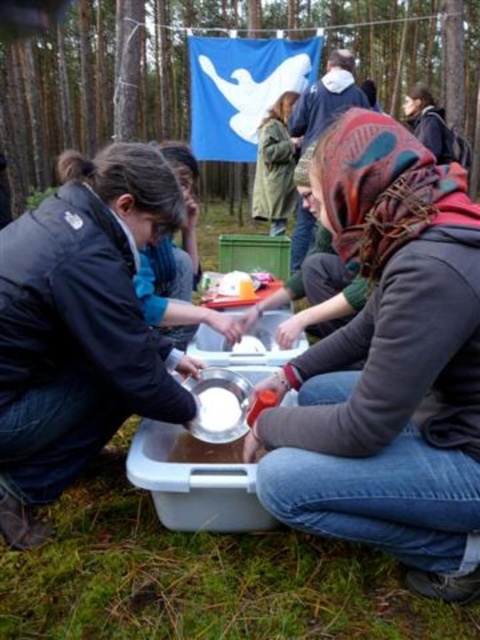
You are standing in the forest scene and need to locate the green matte jacket at center. According to the coordinates provided, where exactly would you find it?

The green matte jacket at center is located at the 2D coordinates point (275, 166).

You are a photographer trying to capture a clear shot of the white matte bowl at center without the matte gray hoodie at center blocking it. Based on the scene, is this possible?

The matte gray hoodie at center is in front of the white matte bowl at center, so it is blocking the view. To capture a clear shot of the white matte bowl at center, you would need to adjust your angle or position to move around the matte gray hoodie at center.

You are a photographer trying to capture a closeup shot of the white matte bowl at center without the matte black jacket at lower left blocking the view. Based on their sizes, is this possible?

The matte black jacket at lower left might be wider than white matte bowl at center, so there is a possibility that the jacket could block the bowl if positioned too closely. Adjust your angle or distance to ensure the jacket doesn